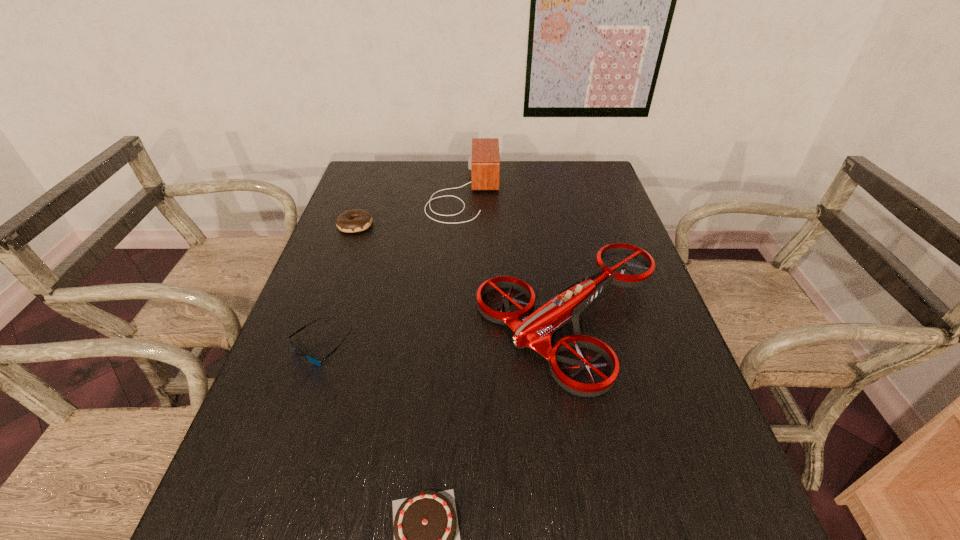
The width and height of the screenshot is (960, 540). I want to click on free spot between the sunglasses and the doughnut, so click(x=338, y=285).

This screenshot has height=540, width=960. Identify the location of the second closest object to the doughnut. (534, 330).

Identify the location of object identified as the closest to the tallest object. The height and width of the screenshot is (540, 960). (355, 220).

Where is `free space in the image that satisfies the following two spatial constraints: 1. on the front-facing side of the tallest object; 2. on the left side of the second tallest object`? Image resolution: width=960 pixels, height=540 pixels. free space in the image that satisfies the following two spatial constraints: 1. on the front-facing side of the tallest object; 2. on the left side of the second tallest object is located at coordinates click(x=457, y=322).

This screenshot has width=960, height=540. In order to click on vacant area that satisfies the following two spatial constraints: 1. on the front side of the doughnut; 2. on the right side of the second tallest object in this screenshot , I will do `click(321, 322)`.